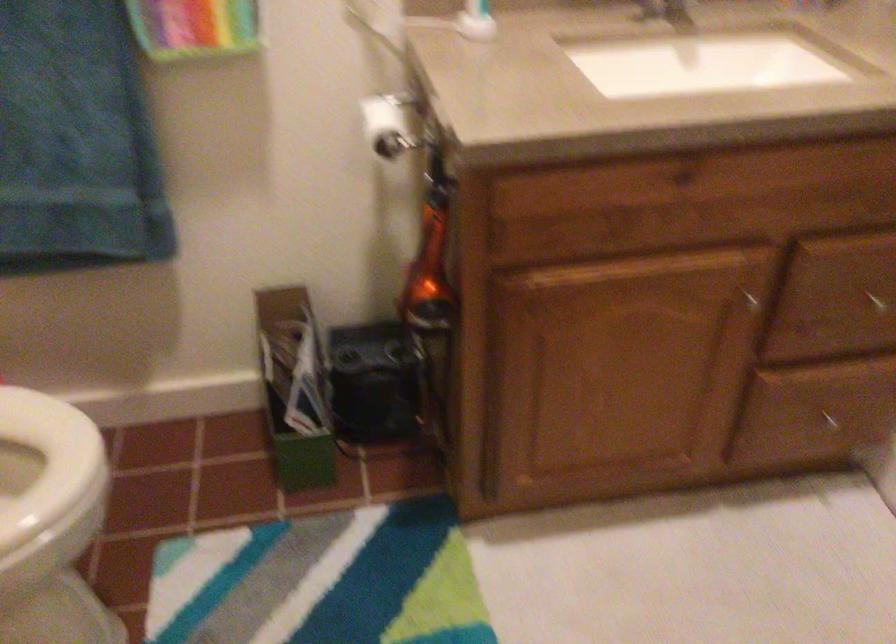
What do you see at coordinates (388, 125) in the screenshot? I see `the toilet paper roll` at bounding box center [388, 125].